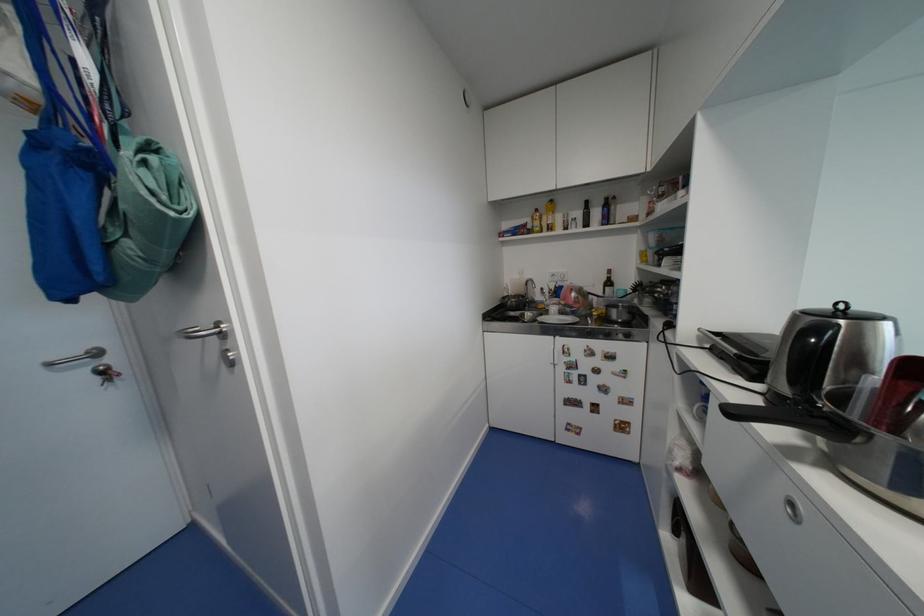
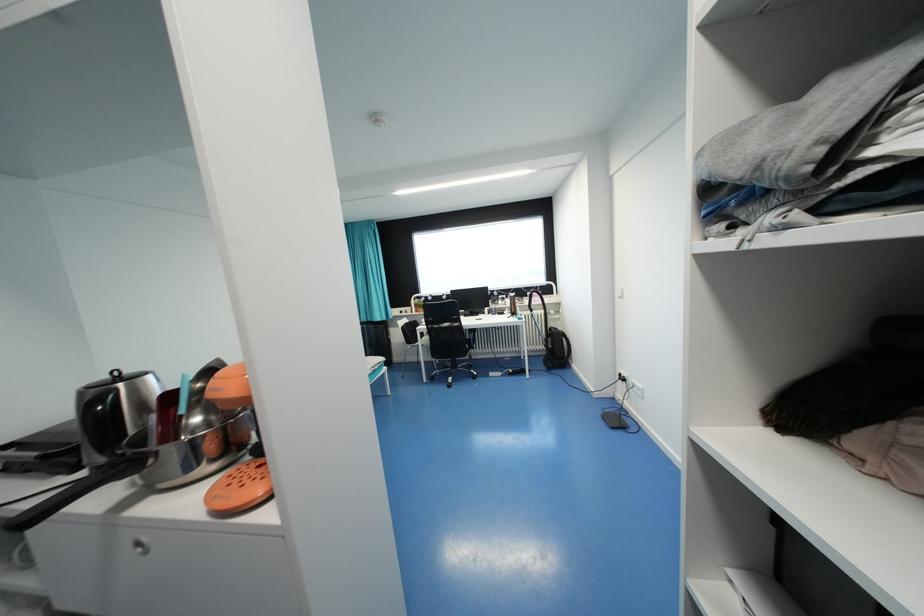
The point at (x=761, y=387) is marked in the first image. Where is the corresponding point in the second image?

(88, 475)